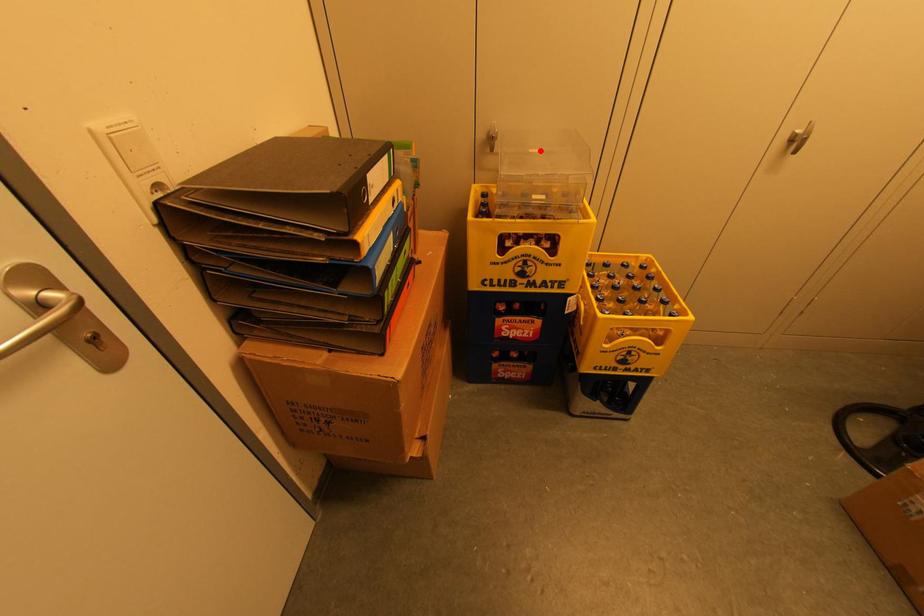
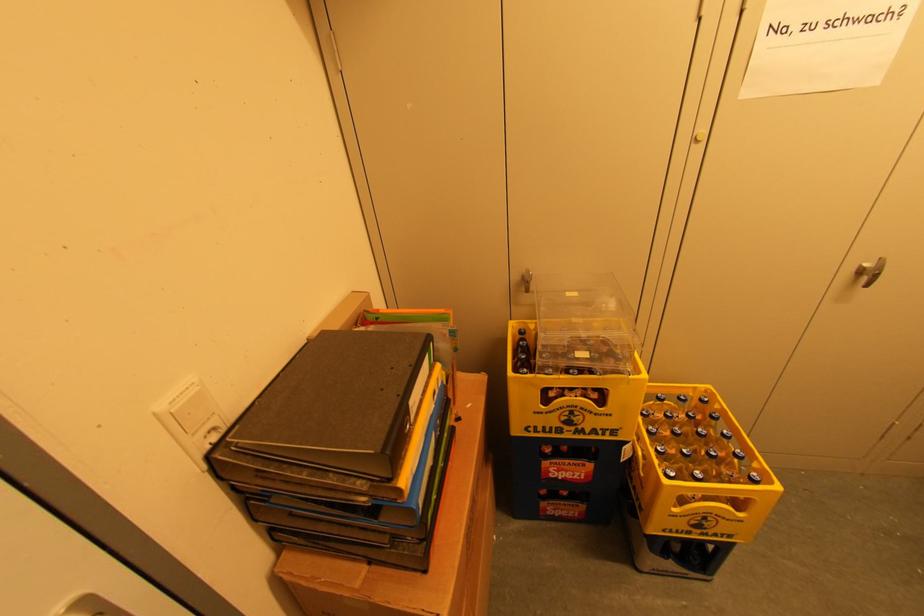
In the second image, find the point that corresponds to the highlighted location in the first image.

(578, 294)